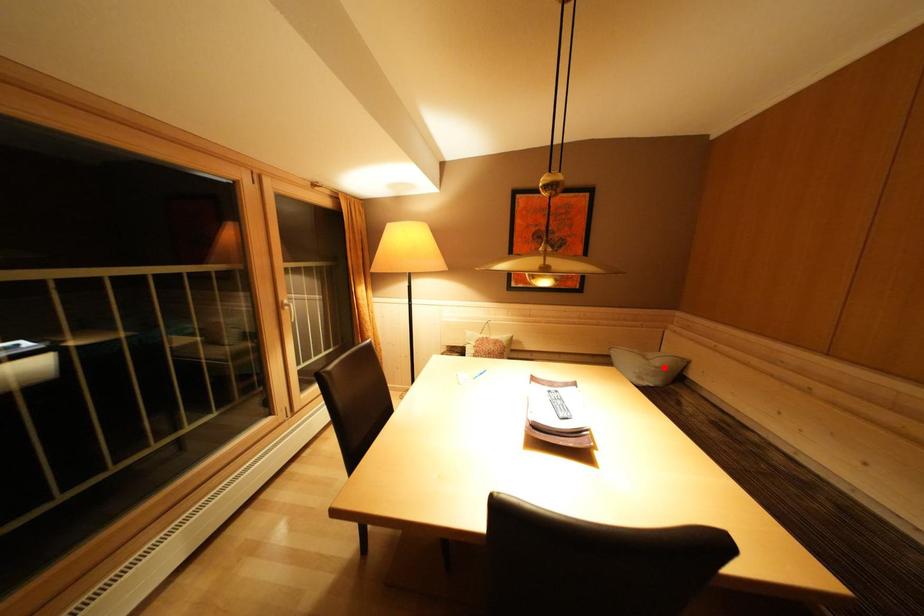
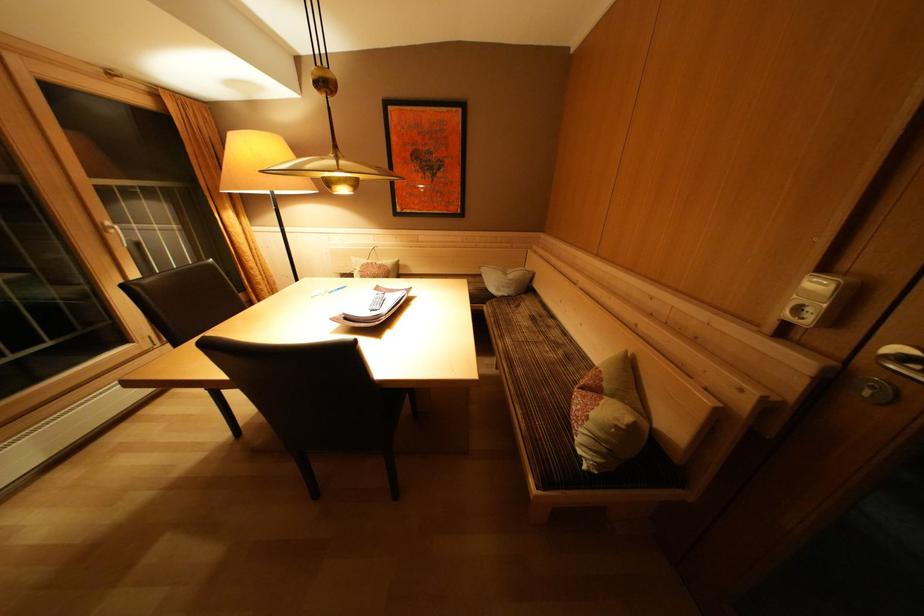
Find the pixel in the second image that matches the highlighted location in the first image.

(517, 281)